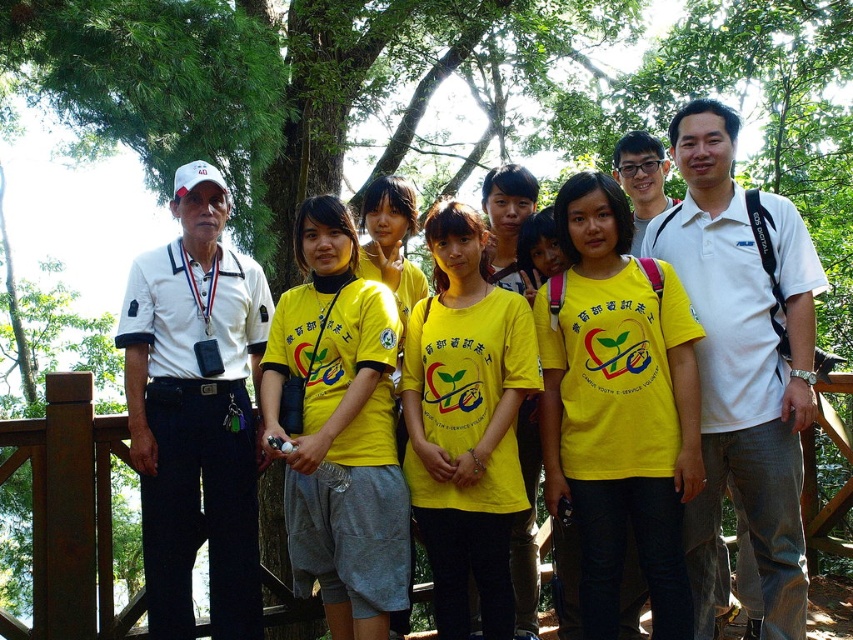
You are a photographer trying to capture a clear photo of both the yellow matte shirt at center and the yellow cotton shirt at center. Since the shirts are similar in color, you need to adjust your focus based on their sizes. Which shirt should you focus on first to ensure it appears sharp in the photo?

The yellow matte shirt at center is smaller in size compared to the yellow cotton shirt at center. To ensure both appear sharp, focus on the smaller yellow matte shirt at center first, as it requires more precise focus due to its smaller size.

Where is the yellow cotton shirt at center located in the image?

The yellow cotton shirt at center is located at point (338, 428) in the image.